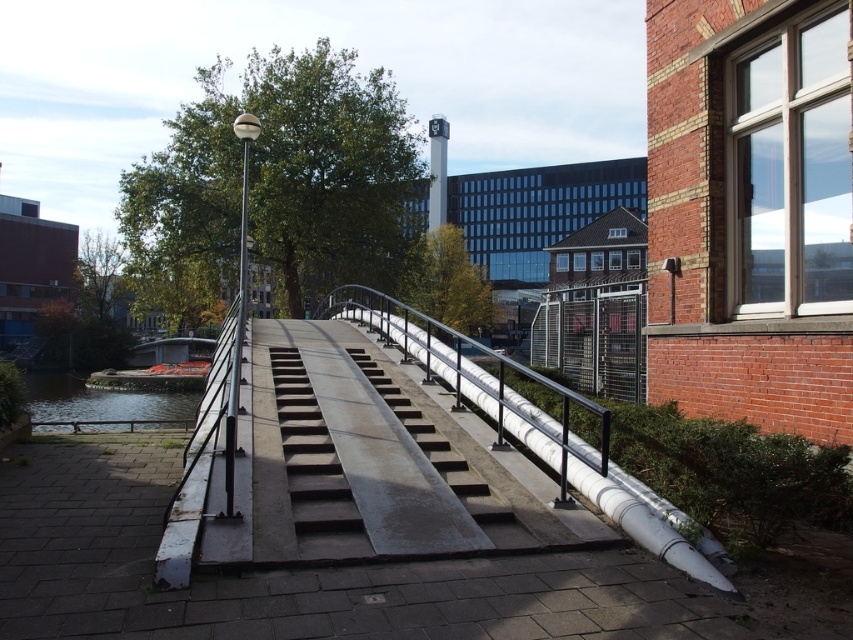
Question: Does metallic gray bridge at center have a larger size compared to greenish water at lower left?

Choices:
 (A) yes
 (B) no

Answer: (B)

Question: Which of the following is the closest to the observer?

Choices:
 (A) (88, 416)
 (B) (331, 502)
 (C) (190, 550)

Answer: (C)

Question: Observing the image, what is the correct spatial positioning of metallic gray bridge at center in reference to concrete stairs at center?

Choices:
 (A) right
 (B) left

Answer: (B)

Question: Can you confirm if concrete stairs at center is positioned to the right of greenish water at lower left?

Choices:
 (A) yes
 (B) no

Answer: (A)

Question: Which point is farther to the camera?

Choices:
 (A) concrete stairs at center
 (B) greenish water at lower left

Answer: (B)

Question: Based on their relative distances, which object is nearer to the metallic gray bridge at center?

Choices:
 (A) concrete stairs at center
 (B) greenish water at lower left

Answer: (A)